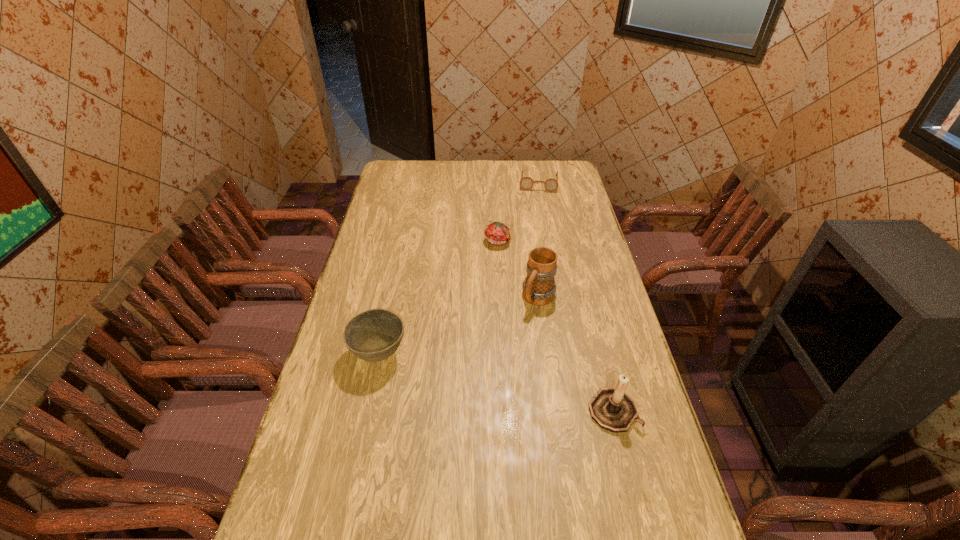
Find the location of a particular element. object that is the second closest one to the second farthest object is located at coordinates (526, 183).

Choose which object is the third nearest neighbor to the third shortest object. Please provide its 2D coordinates. Your answer should be formatted as a tuple, i.e. [(x, y)], where the tuple contains the x and y coordinates of a point satisfying the conditions above.

[(613, 409)]

You are a GUI agent. You are given a task and a screenshot of the screen. Output one action in this format:
    pyautogui.click(x=<x>, y=<y>)
    Task: Click on the blank space that satisfies the following two spatial constraints: 1. on the back side of the shortest object; 2. on the right side of the third farthest object
    
    Given the screenshot: What is the action you would take?
    pyautogui.click(x=523, y=183)